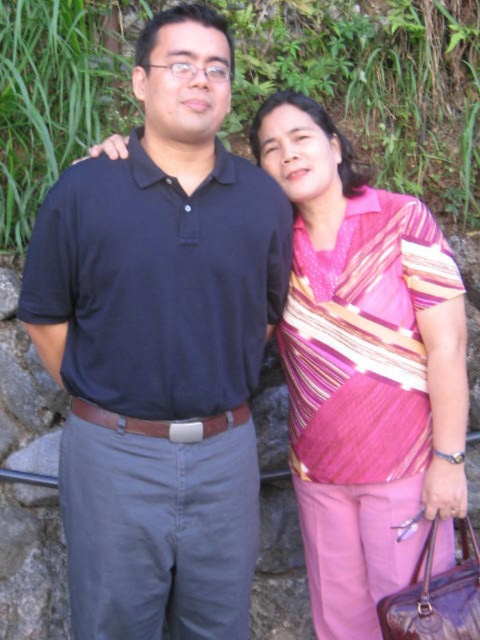
You are taking a photo of two people standing in front of you. You notice two points in the scene labeled as point (49, 275) and point (398, 225). Which point is closer to your camera?

Point (49, 275) is closer to the camera than point (398, 225).

You are a photographer setting up for a group photo. You have two subjects wearing the matte black shirt at center and the pink striped blouse at center. You want to ensure both subjects can fit comfortably side by side within a 1.8 meter wide frame. Given their clothing widths, is this arrangement feasible?

The matte black shirt at center has a larger width than the pink striped blouse at center. However, without knowing the exact widths of both items, it is impossible to determine if their combined width exceeds the 1.8 meter frame. Additional measurements are needed.

You are a photographer standing 10 feet away from the scene. You want to focus on the matte black shirt at center. Is the distance sufficient for your camera to capture it clearly?

The matte black shirt at center is 6.48 feet away from the viewer. Since you are standing 10 feet away, the distance is sufficient for the camera to capture it clearly as it is within the focusing range.